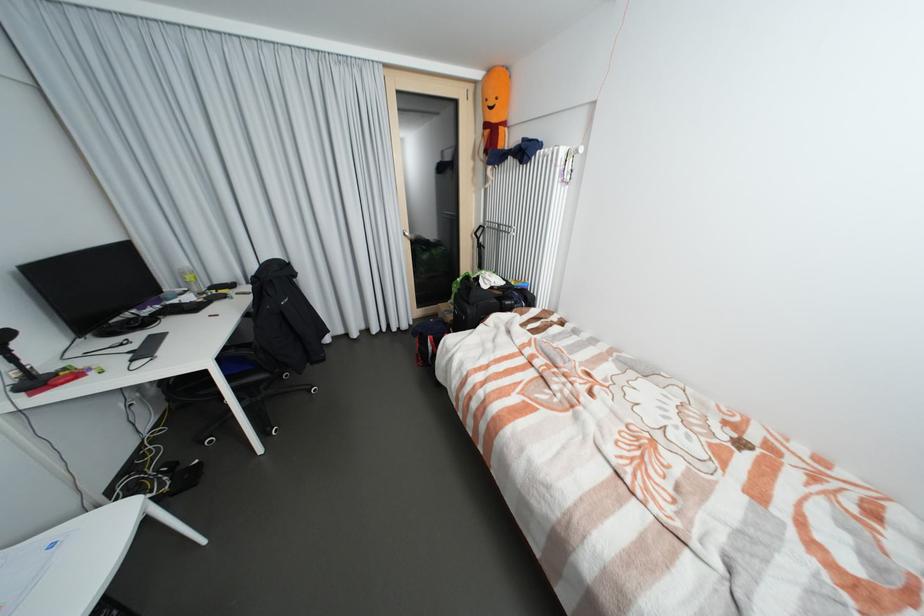
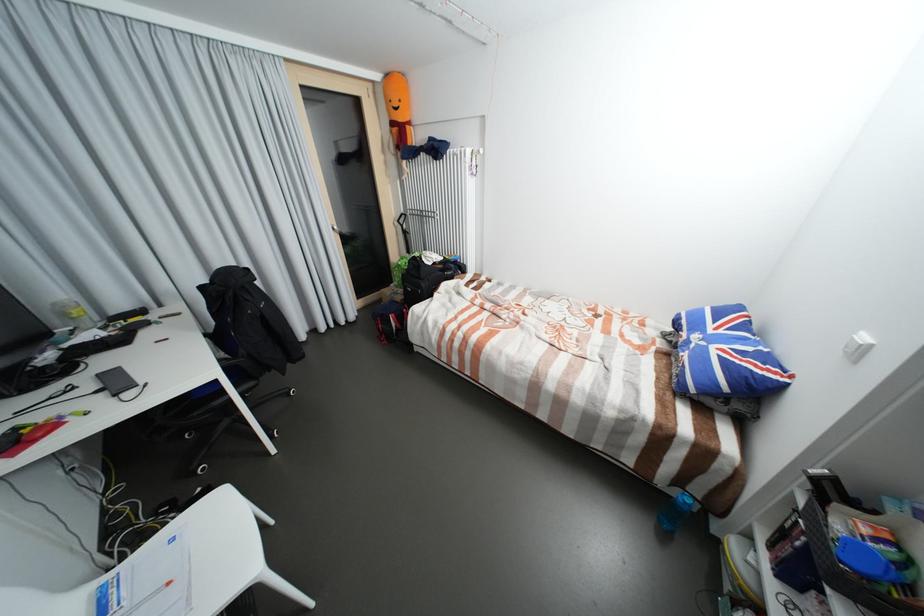
Question: How did the camera likely rotate?

Choices:
 (A) Left
 (B) Right
 (C) Up
 (D) Down

Answer: (B)